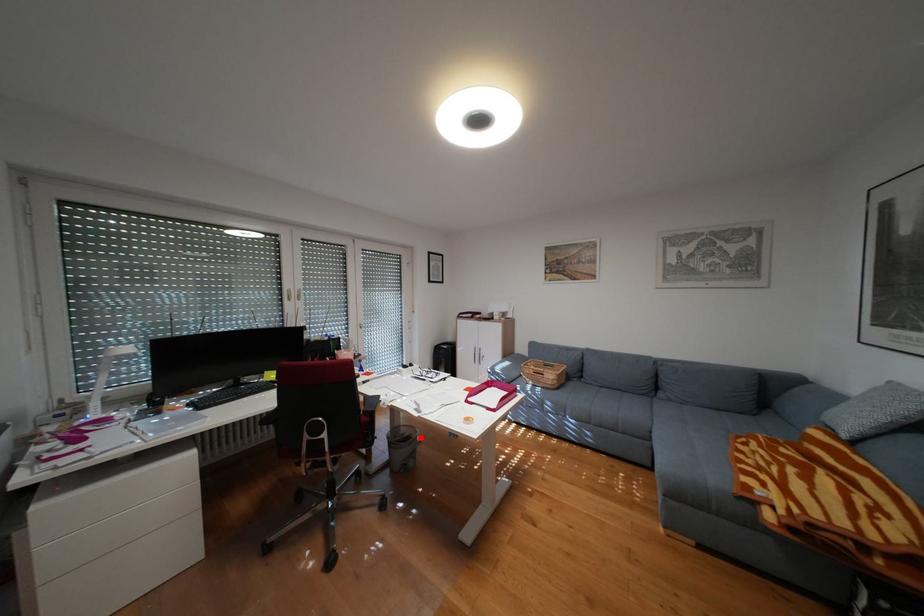
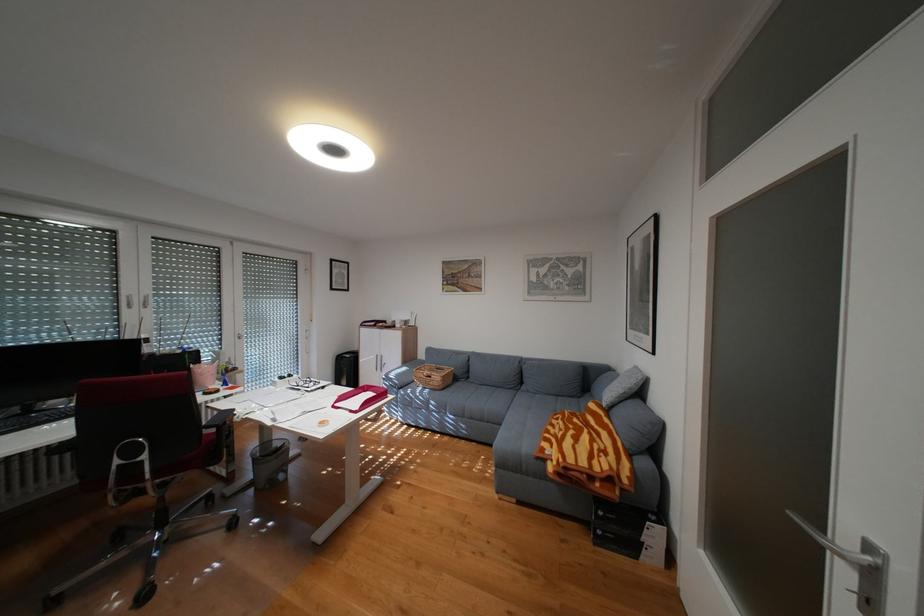
In the second image, find the point that corresponds to the highlighted location in the first image.

(288, 451)